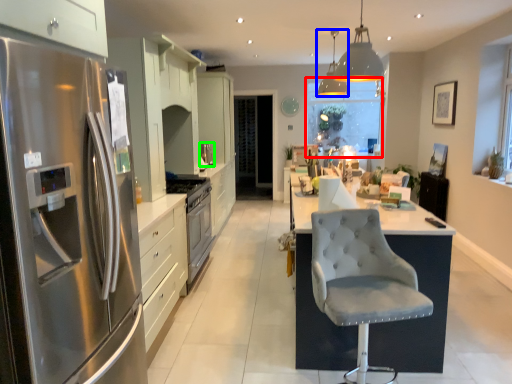
Question: Based on their relative distances, which object is farther from window screen (highlighted by a red box)? Choose from light fixture (highlighted by a blue box) and appliance (highlighted by a green box).

Choices:
 (A) light fixture
 (B) appliance

Answer: (B)